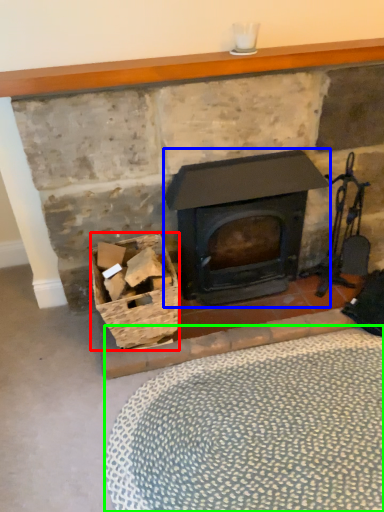
Question: Which object is positioned closest to basket (highlighted by a red box)? Select from wood burning stove (highlighted by a blue box) and plain (highlighted by a green box).

Choices:
 (A) wood burning stove
 (B) plain

Answer: (A)